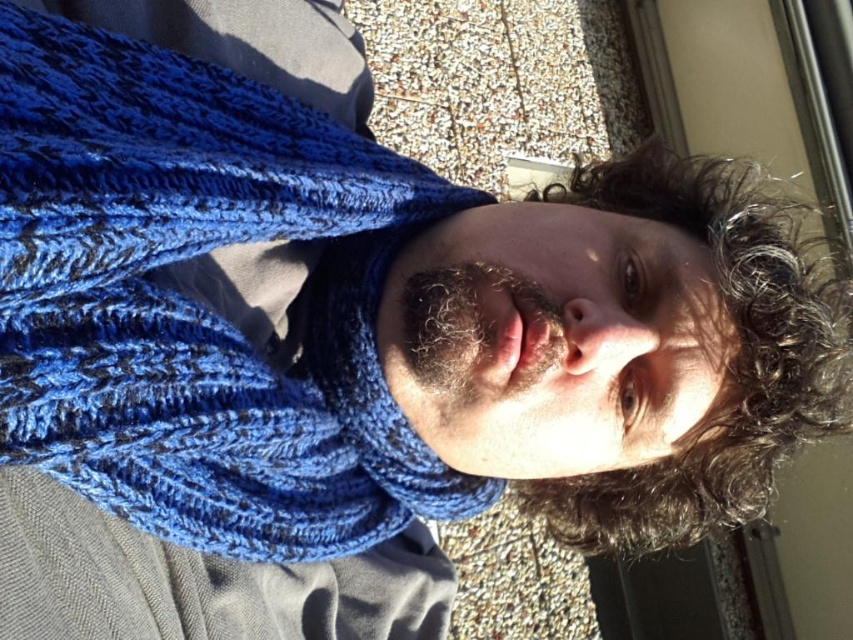
Does blue knitted scarf at center have a larger size compared to curly brown hair at upper right?

No.

Is point (68, 360) less distant than point (575, 506)?

Yes.

This screenshot has height=640, width=853. In order to click on blue knitted scarf at center in this screenshot , I will do `click(199, 304)`.

Where is `blue knitted scarf at center`? The height and width of the screenshot is (640, 853). blue knitted scarf at center is located at coordinates (199, 304).